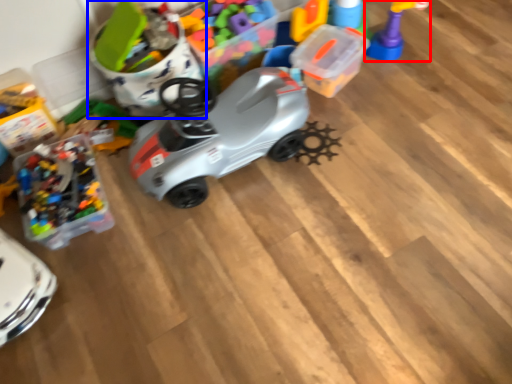
Question: Which of the following is the farthest to the observer, toy (highlighted by a red box) or toy (highlighted by a blue box)?

Choices:
 (A) toy
 (B) toy

Answer: (A)